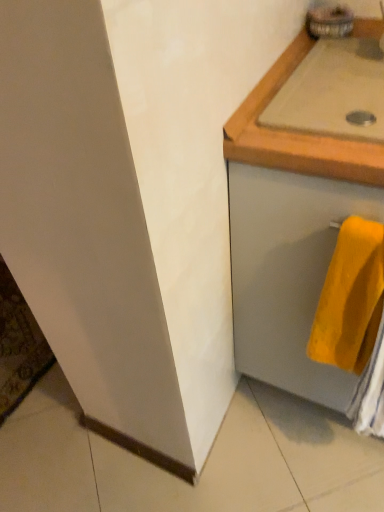
Question: From the image's perspective, does yellow soft towel at lower right appear lower than beige wood countertop at upper right?

Choices:
 (A) no
 (B) yes

Answer: (B)

Question: Is yellow soft towel at lower right directly adjacent to beige wood countertop at upper right?

Choices:
 (A) no
 (B) yes

Answer: (A)

Question: Does yellow soft towel at lower right appear on the left side of beige wood countertop at upper right?

Choices:
 (A) yes
 (B) no

Answer: (A)

Question: From a real-world perspective, is yellow soft towel at lower right under beige wood countertop at upper right?

Choices:
 (A) no
 (B) yes

Answer: (B)

Question: Is yellow soft towel at lower right far from beige wood countertop at upper right?

Choices:
 (A) yes
 (B) no

Answer: (B)

Question: In terms of width, does yellow soft towel at lower right look wider or thinner when compared to beige wood countertop at upper right?

Choices:
 (A) wide
 (B) thin

Answer: (B)

Question: Choose the correct answer: Is yellow soft towel at lower right inside beige wood countertop at upper right or outside it?

Choices:
 (A) inside
 (B) outside

Answer: (B)

Question: Is yellow soft towel at lower right in front of or behind beige wood countertop at upper right in the image?

Choices:
 (A) front
 (B) behind

Answer: (A)

Question: Considering the positions of yellow soft towel at lower right and beige wood countertop at upper right in the image, is yellow soft towel at lower right bigger or smaller than beige wood countertop at upper right?

Choices:
 (A) small
 (B) big

Answer: (A)

Question: From a real-world perspective, relative to yellow soft towel at lower right, is matte gray drawer at right vertically above or below?

Choices:
 (A) below
 (B) above

Answer: (A)

Question: Is matte gray drawer at right to the left or to the right of yellow soft towel at lower right in the image?

Choices:
 (A) right
 (B) left

Answer: (A)

Question: Is matte gray drawer at right inside the boundaries of yellow soft towel at lower right, or outside?

Choices:
 (A) outside
 (B) inside

Answer: (A)

Question: Is matte gray drawer at right bigger or smaller than yellow soft towel at lower right?

Choices:
 (A) big
 (B) small

Answer: (A)

Question: Which is correct: yellow soft towel at lower right is inside matte gray drawer at right, or outside of it?

Choices:
 (A) inside
 (B) outside

Answer: (A)

Question: Would you say yellow soft towel at lower right is to the left or to the right of matte gray drawer at right in the picture?

Choices:
 (A) left
 (B) right

Answer: (A)